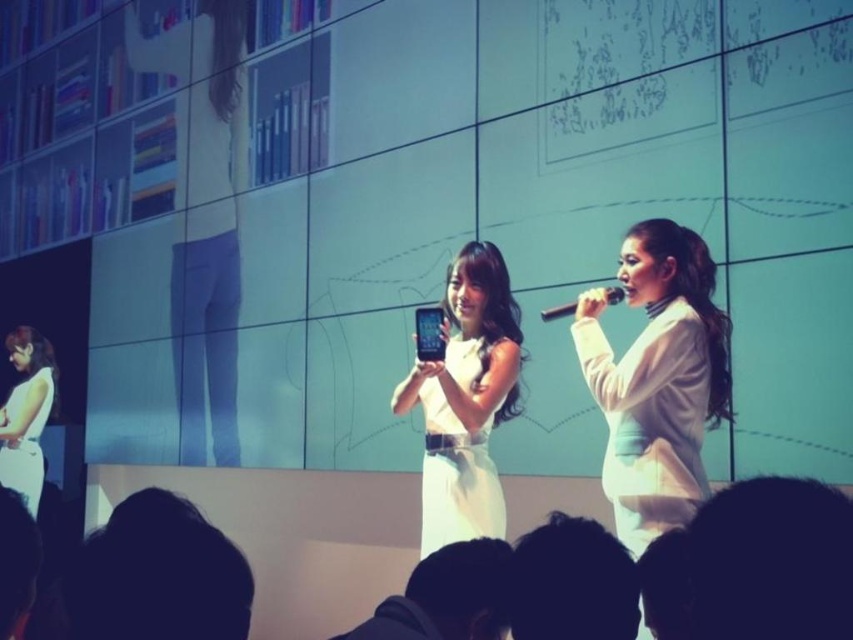
Is white satin dress at center wider than white matte dress at left?

Incorrect, white satin dress at center's width does not surpass white matte dress at left's.

Does white satin dress at center have a smaller size compared to white matte dress at left?

Yes.

Who is more distant from viewer, (428, 502) or (38, 481)?

Point (38, 481)

You are a GUI agent. You are given a task and a screenshot of the screen. Output one action in this format:
    pyautogui.click(x=<x>, y=<y>)
    Task: Click on the white satin dress at center
    
    Given the screenshot: What is the action you would take?
    pyautogui.click(x=456, y=476)

Does white satin dress at center lie in front of black hair at lower left?

No, white satin dress at center is further to the viewer.

Who is shorter, white satin dress at center or black hair at lower left?

Standing shorter between the two is black hair at lower left.

Is point (450, 536) farther from camera compared to point (0, 492)?

Yes, it is.

This screenshot has width=853, height=640. What are the coordinates of `white satin dress at center` in the screenshot? It's located at (456, 476).

Who is positioned more to the right, dark hair at lower left or white matte dress at left?

dark hair at lower left is more to the right.

Can you confirm if dark hair at lower left is shorter than white matte dress at left?

Indeed, dark hair at lower left has a lesser height compared to white matte dress at left.

Who is more distant from viewer, (x=148, y=611) or (x=39, y=419)?

Point (x=39, y=419)

Where is `dark hair at lower left`? dark hair at lower left is located at coordinates (160, 576).